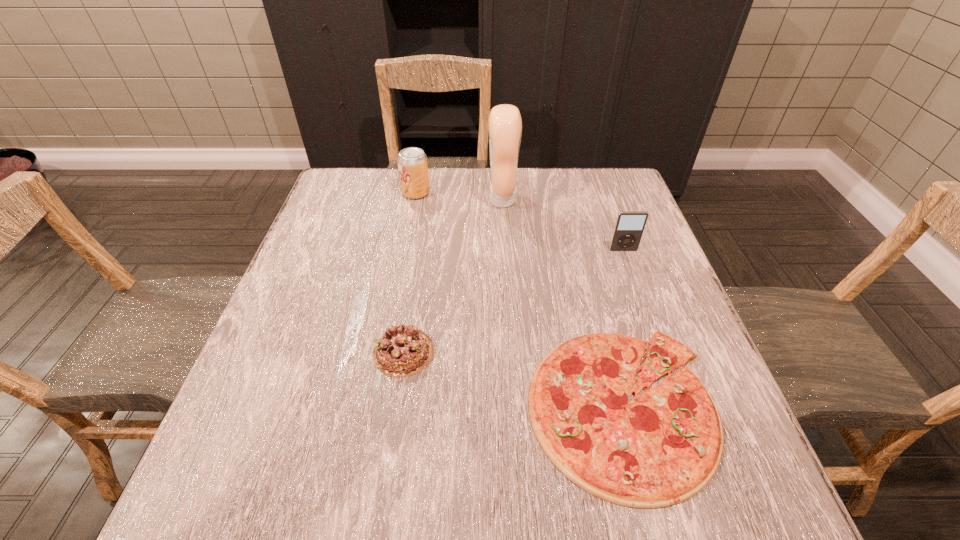
Find the location of a particular element. This screenshot has width=960, height=540. free point located 0.210m on the front of the chocolate cake is located at coordinates (382, 496).

Find the location of a particular element. Image resolution: width=960 pixels, height=540 pixels. blank space located 0.380m on the back of the shortest object is located at coordinates (575, 220).

You are a GUI agent. You are given a task and a screenshot of the screen. Output one action in this format:
    pyautogui.click(x=<x>, y=<y>)
    Task: Click on the condiment located at the far edge
    
    Given the screenshot: What is the action you would take?
    pyautogui.click(x=505, y=123)

Find the location of a particular element. The image size is (960, 540). pop (soda) present at the far edge is located at coordinates (412, 162).

Locate an element on the screen. object located in the near edge section of the desktop is located at coordinates (663, 447).

At what (x,y) coordinates should I click in order to perform the action: click on iPod that is at the right edge. Please return your answer as a coordinate pair (x, y). This screenshot has height=540, width=960. Looking at the image, I should click on (629, 226).

I want to click on pizza present at the right edge, so click(x=663, y=447).

The height and width of the screenshot is (540, 960). What are the coordinates of `object at the near right corner` in the screenshot? It's located at (663, 447).

Where is `free space at the far edge`? Image resolution: width=960 pixels, height=540 pixels. free space at the far edge is located at coordinates (433, 186).

At what (x,y) coordinates should I click in order to perform the action: click on blank area at the left edge. Please return your answer as a coordinate pair (x, y). Image resolution: width=960 pixels, height=540 pixels. Looking at the image, I should click on pyautogui.click(x=351, y=278).